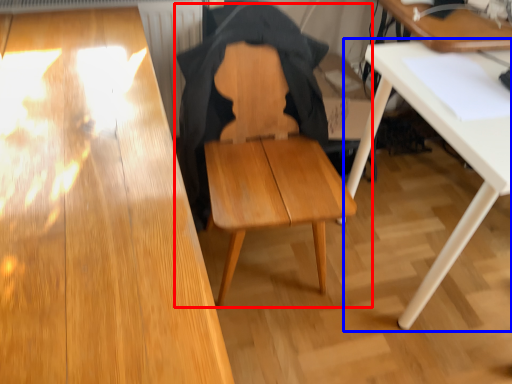
Question: Which point is further to the camera, chair (highlighted by a red box) or table (highlighted by a blue box)?

Choices:
 (A) chair
 (B) table

Answer: (B)